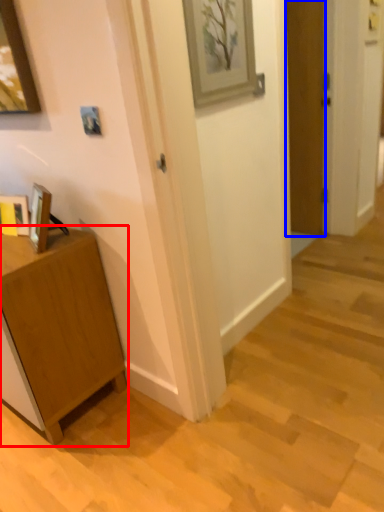
Question: Which point is further to the camera, cabinetry (highlighted by a red box) or door (highlighted by a blue box)?

Choices:
 (A) cabinetry
 (B) door

Answer: (B)